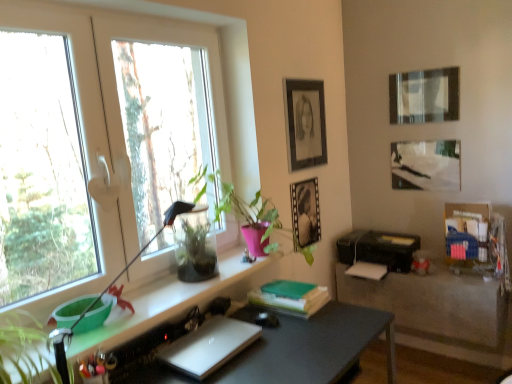
Question: Is the depth of green glossy plant at center greater than that of black plastic printer at lower right?

Choices:
 (A) yes
 (B) no

Answer: (B)

Question: Can you confirm if green glossy plant at center is smaller than black plastic printer at lower right?

Choices:
 (A) yes
 (B) no

Answer: (B)

Question: Does green glossy plant at center have a greater width compared to black plastic printer at lower right?

Choices:
 (A) no
 (B) yes

Answer: (A)

Question: Is green glossy plant at center shorter than black plastic printer at lower right?

Choices:
 (A) yes
 (B) no

Answer: (B)

Question: From a real-world perspective, is green glossy plant at center under black plastic printer at lower right?

Choices:
 (A) yes
 (B) no

Answer: (B)

Question: In terms of size, does matte gray desk at center appear bigger or smaller than black plastic printer at lower right?

Choices:
 (A) small
 (B) big

Answer: (B)

Question: Is matte gray desk at center in front of or behind black plastic printer at lower right in the image?

Choices:
 (A) front
 (B) behind

Answer: (A)

Question: Visually, is matte gray desk at center positioned to the left or to the right of black plastic printer at lower right?

Choices:
 (A) left
 (B) right

Answer: (A)

Question: Is matte gray desk at center inside or outside of black plastic printer at lower right?

Choices:
 (A) inside
 (B) outside

Answer: (B)

Question: In terms of size, does green glossy plant at center appear bigger or smaller than transparent glass vase at window?

Choices:
 (A) small
 (B) big

Answer: (B)

Question: Is green glossy plant at center to the left or to the right of transparent glass vase at window in the image?

Choices:
 (A) right
 (B) left

Answer: (A)

Question: From the image's perspective, is green glossy plant at center above or below transparent glass vase at window?

Choices:
 (A) above
 (B) below

Answer: (A)

Question: Is green glossy plant at center wider or thinner than transparent glass vase at window?

Choices:
 (A) wide
 (B) thin

Answer: (A)

Question: From a real-world perspective, is matte black picture frame at upper right, arranged as the 3th picture frame when viewed from the left, physically located above or below matte gray desk at center?

Choices:
 (A) below
 (B) above

Answer: (B)

Question: Is matte black picture frame at upper right, arranged as the 3th picture frame when viewed from the left, in front of or behind matte gray desk at center in the image?

Choices:
 (A) front
 (B) behind

Answer: (B)